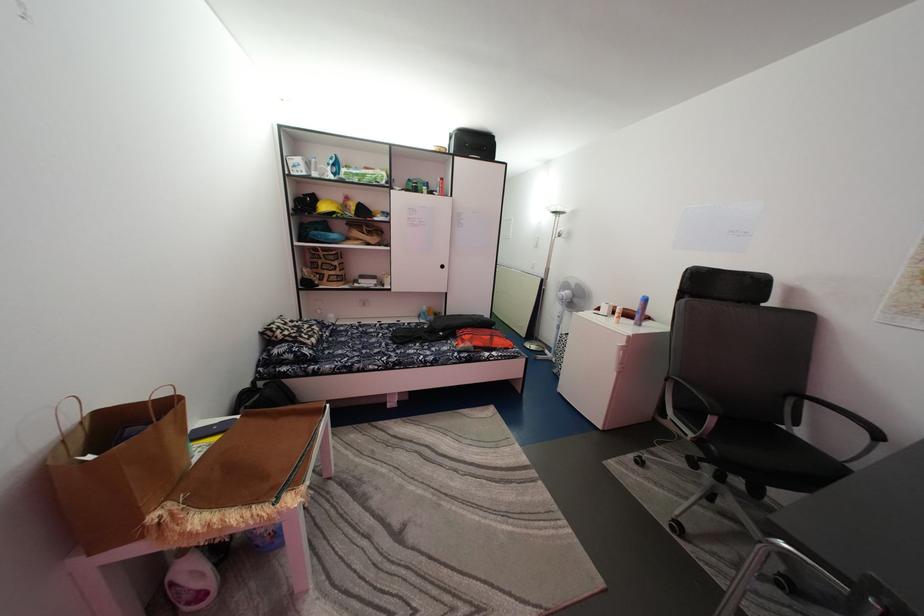
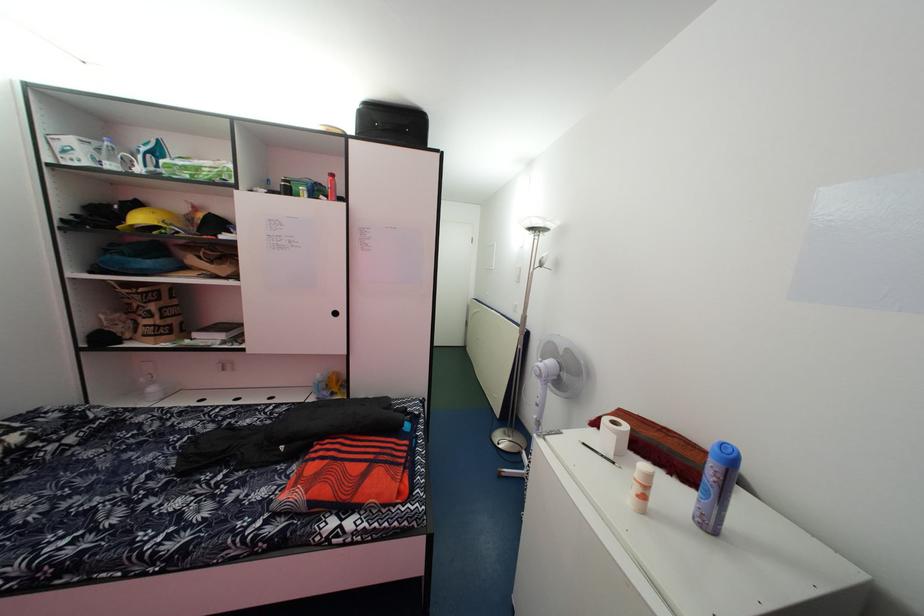
Locate, in the second image, the point that corresponds to [604,318] in the first image.

(600, 442)